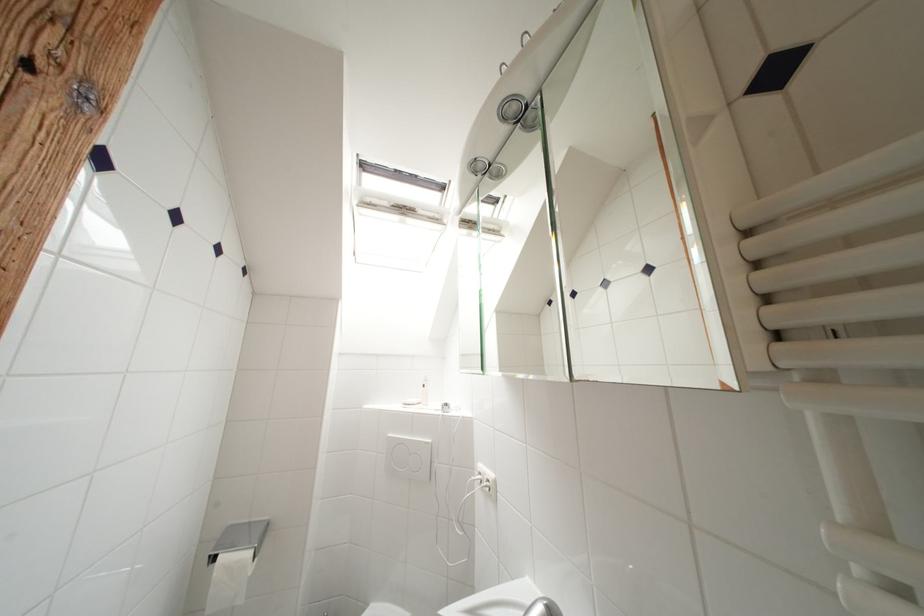
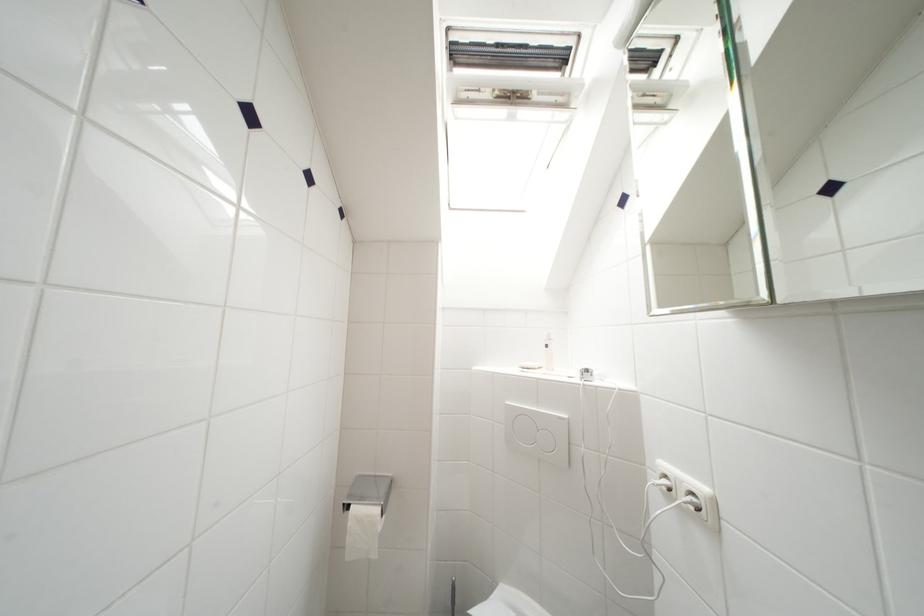
Question: How did the camera likely rotate?

Choices:
 (A) Left
 (B) Right
 (C) Up
 (D) Down

Answer: (A)